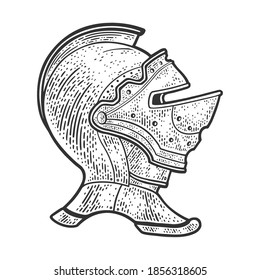
Locate an element on the screen. This screenshot has width=260, height=280. hinge is located at coordinates (101, 115).